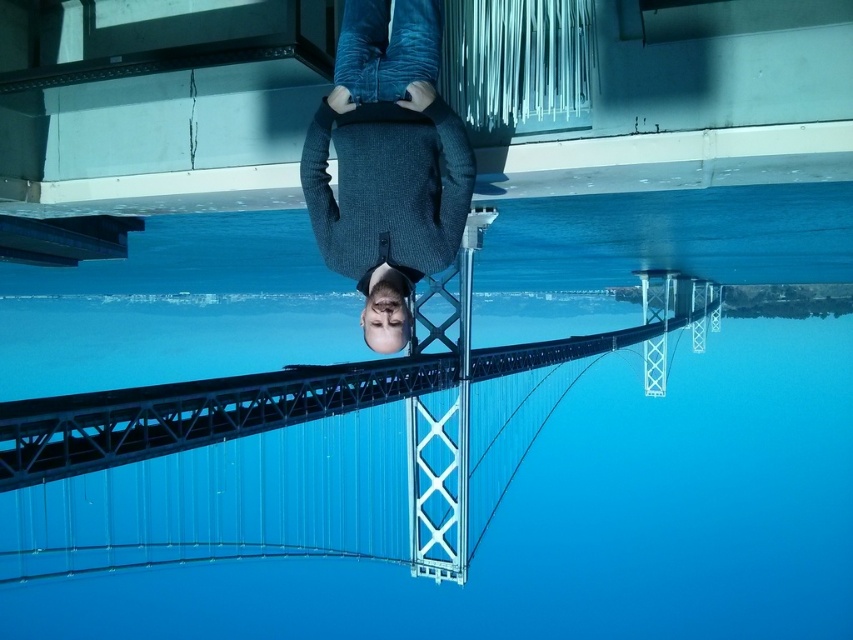
In the scene shown: You are a painter standing at the edge of the blue glass swimming pool at center and want to paint the metallic bridge rail at center. Which object is wider from your perspective?

The blue glass swimming pool at center might be wider than metallic bridge rail at center.

You are designing a safety barrier for the blue glass swimming pool at center and the dark blue sweater at center. Since the pool is wider than the sweater, how should you adjust the barrier design to accommodate both?

The blue glass swimming pool at center is wider than the dark blue sweater at center, so the safety barrier should be designed to cover the entire width of the pool while ensuring it also accommodates the sweater area appropriately.